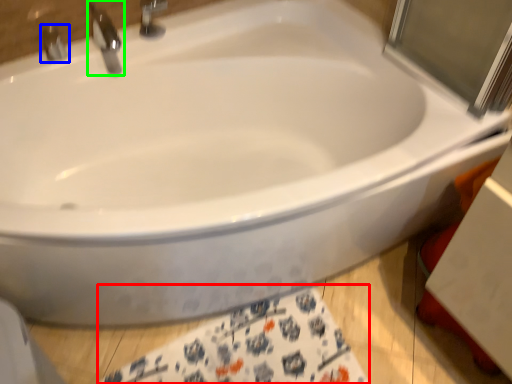
Question: Which object is positioned farthest from bath towel (highlighted by a red box)? Select from tap (highlighted by a blue box) and tap (highlighted by a green box).

Choices:
 (A) tap
 (B) tap

Answer: (A)